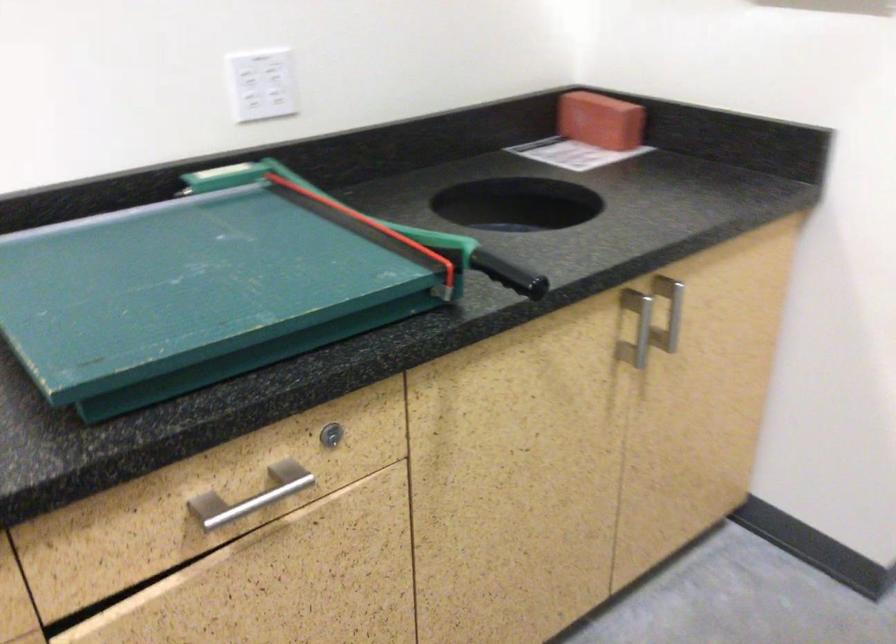
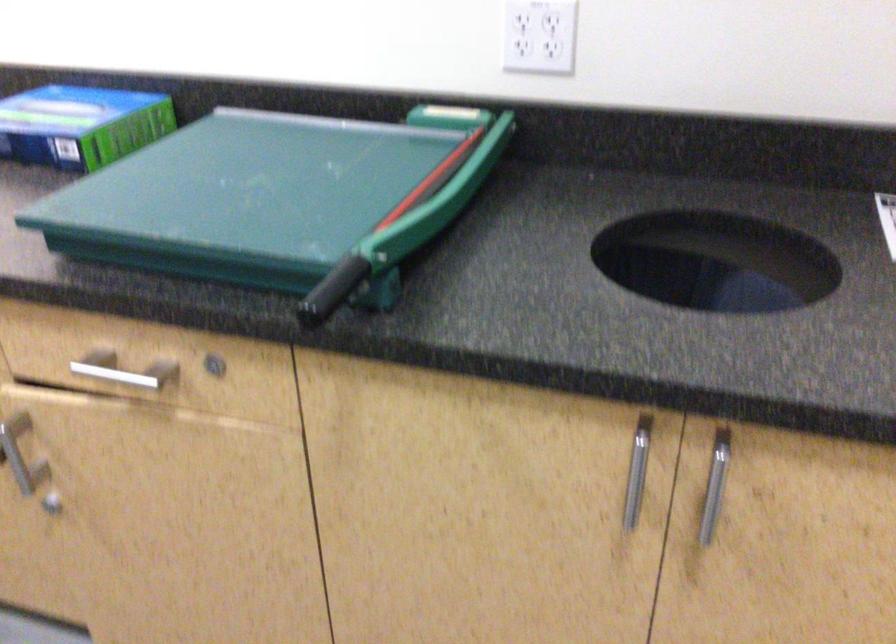
Where in the second image is the point corresponding to point (529, 270) from the first image?

(332, 290)